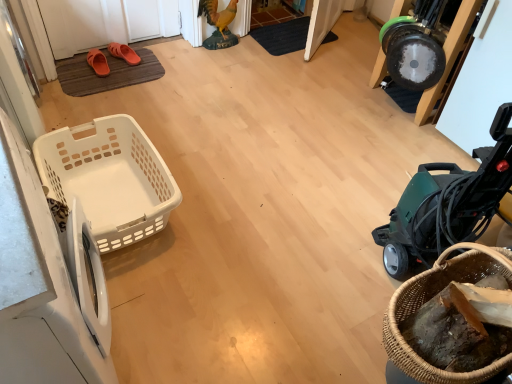
Locate an element on the screen. Image resolution: width=512 pixels, height=384 pixels. vacant region to the left of green plastic vacuum cleaner at right is located at coordinates (332, 256).